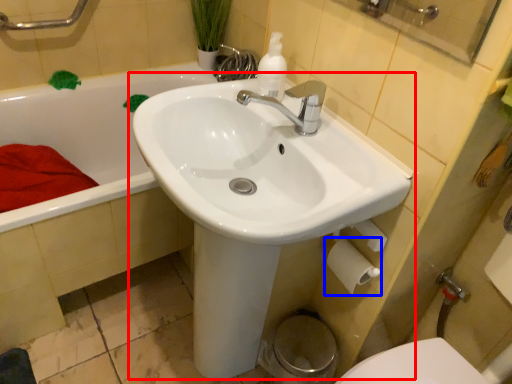
Question: Which point is further to the camera, sink (highlighted by a red box) or toilet paper (highlighted by a blue box)?

Choices:
 (A) sink
 (B) toilet paper

Answer: (B)